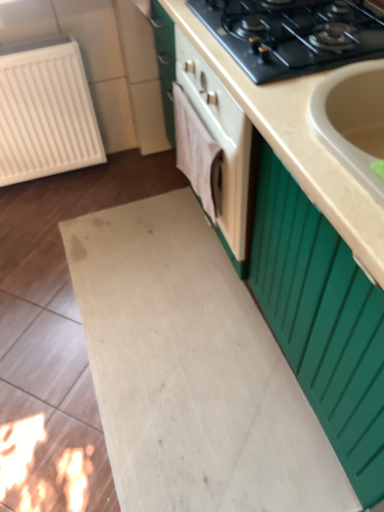
Question: Can you confirm if white plastic radiator at left is shorter than beige matte countertop at center?

Choices:
 (A) no
 (B) yes

Answer: (B)

Question: Does white plastic radiator at left have a lesser width compared to beige matte countertop at center?

Choices:
 (A) yes
 (B) no

Answer: (A)

Question: Would you say white plastic radiator at left is outside beige matte countertop at center?

Choices:
 (A) no
 (B) yes

Answer: (B)

Question: Considering the relative positions of white plastic radiator at left and beige matte countertop at center in the image provided, is white plastic radiator at left in front of beige matte countertop at center?

Choices:
 (A) yes
 (B) no

Answer: (B)

Question: Is white plastic radiator at left beside beige matte countertop at center?

Choices:
 (A) yes
 (B) no

Answer: (B)

Question: Considering their positions, is beige matte countertop at center located in front of or behind white plastic radiator at left?

Choices:
 (A) front
 (B) behind

Answer: (A)

Question: Is beige matte countertop at center spatially inside white plastic radiator at left, or outside of it?

Choices:
 (A) outside
 (B) inside

Answer: (A)

Question: Looking at their shapes, would you say beige matte countertop at center is wider or thinner than white plastic radiator at left?

Choices:
 (A) wide
 (B) thin

Answer: (A)

Question: From the image's perspective, is beige matte countertop at center positioned above or below white plastic radiator at left?

Choices:
 (A) below
 (B) above

Answer: (A)

Question: Considering the positions of point (306, 19) and point (41, 70), is point (306, 19) closer or farther from the camera than point (41, 70)?

Choices:
 (A) closer
 (B) farther

Answer: (A)

Question: From a real-world perspective, is black matte gas stove at upper center above or below white plastic radiator at left?

Choices:
 (A) above
 (B) below

Answer: (A)

Question: Is black matte gas stove at upper center bigger or smaller than white plastic radiator at left?

Choices:
 (A) small
 (B) big

Answer: (A)

Question: From the image's perspective, is black matte gas stove at upper center located above or below white plastic radiator at left?

Choices:
 (A) below
 (B) above

Answer: (B)

Question: Is beige matte countertop at center taller or shorter than black matte gas stove at upper center?

Choices:
 (A) tall
 (B) short

Answer: (A)

Question: Is beige matte countertop at center wider or thinner than black matte gas stove at upper center?

Choices:
 (A) thin
 (B) wide

Answer: (B)